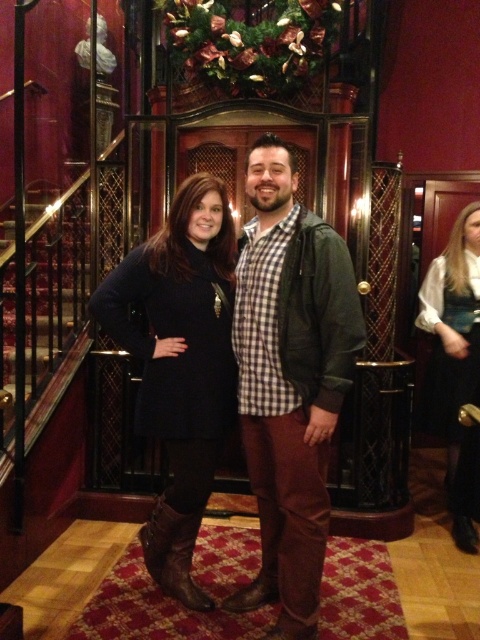
Based on the photo, does green matte jacket at center appear under black satin dress at right?

No, green matte jacket at center is not below black satin dress at right.

Describe the element at coordinates (289, 381) in the screenshot. I see `green matte jacket at center` at that location.

The width and height of the screenshot is (480, 640). In order to click on green matte jacket at center in this screenshot , I will do `click(289, 381)`.

Between point (210, 284) and point (141, 531), which one is positioned behind?

Point (141, 531)

Describe the element at coordinates (180, 364) in the screenshot. The image size is (480, 640). I see `matte black coat at center` at that location.

Locate an element on the screen. matte black coat at center is located at coordinates (180, 364).

Which is below, black satin dress at right or brown leather boot at lower center?

brown leather boot at lower center is lower down.

Does black satin dress at right appear under brown leather boot at lower center?

Incorrect, black satin dress at right is not positioned below brown leather boot at lower center.

Describe the element at coordinates (455, 365) in the screenshot. The image size is (480, 640). I see `black satin dress at right` at that location.

Locate an element on the screen. The image size is (480, 640). black satin dress at right is located at coordinates (455, 365).